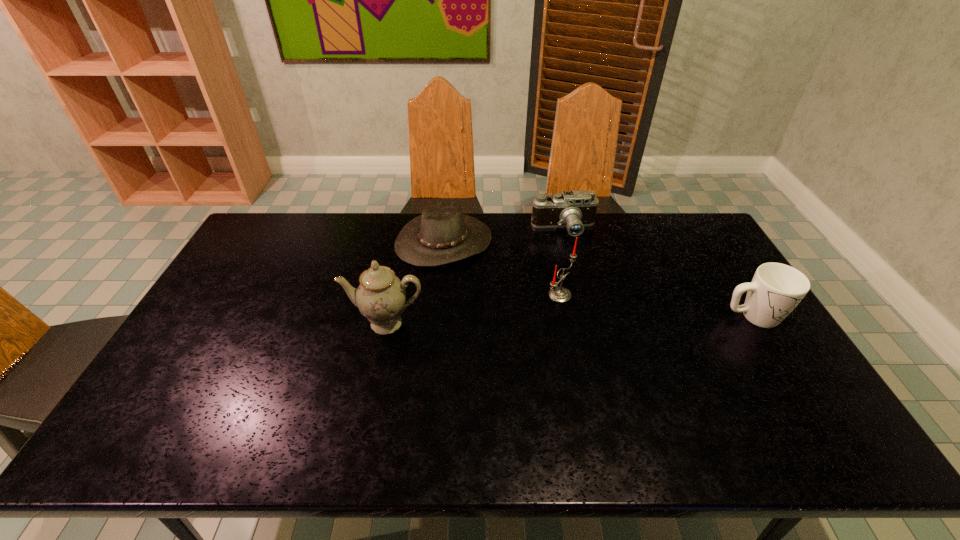
I want to click on vacant area at the left edge, so click(x=253, y=273).

In the image, there is a desktop. At what (x,y) coordinates should I click in order to perform the action: click on free space at the right edge. Please return your answer as a coordinate pair (x, y). Looking at the image, I should click on (788, 380).

In the image, there is a desktop. Where is `free space at the near left corner`? The height and width of the screenshot is (540, 960). free space at the near left corner is located at coordinates (202, 384).

This screenshot has width=960, height=540. I want to click on blank space at the near right corner of the desktop, so click(x=804, y=383).

The image size is (960, 540). In order to click on free space between the rightmost object and the camera in this screenshot , I will do `click(659, 273)`.

At what (x,y) coordinates should I click in order to perform the action: click on vacant area that lies between the rightmost object and the tallest object. Please return your answer as a coordinate pair (x, y). Image resolution: width=960 pixels, height=540 pixels. Looking at the image, I should click on (569, 320).

Where is `vacant space that is in between the camera and the hat`? vacant space that is in between the camera and the hat is located at coordinates (504, 235).

Identify the location of free space between the camera and the chinaware. The width and height of the screenshot is (960, 540). (475, 276).

The image size is (960, 540). Find the location of `unoccupied area between the camera and the tallest object`. unoccupied area between the camera and the tallest object is located at coordinates (475, 276).

Locate an element on the screen. Image resolution: width=960 pixels, height=540 pixels. free space between the hat and the candle is located at coordinates (502, 268).